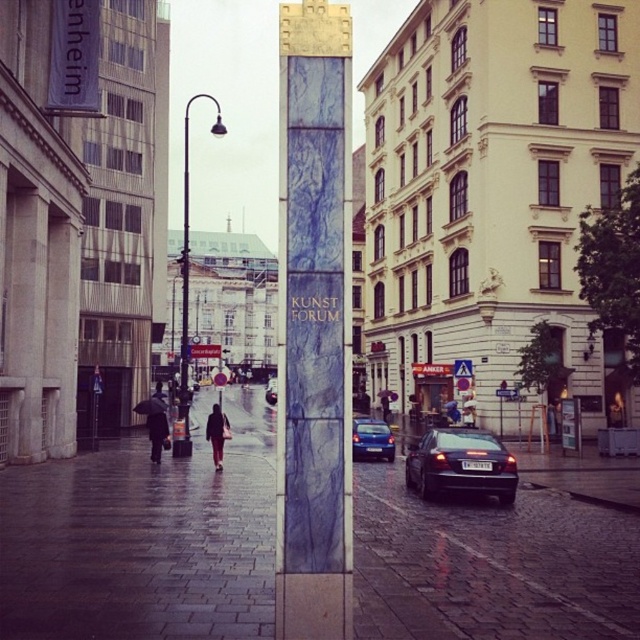
You are a delivery person trying to place a large package on the ground. You see the brick pavement at center and the dark brown leather coat at lower center. Which surface can you place the package on?

The brick pavement at center is bigger than the dark brown leather coat at lower center, so you can place the package on the brick pavement at center.

You are standing in front of the blue marble pillar at center. If you want to take a photo of it with your camera, which is 25.57 feet away, will you be able to capture the entire pillar in the frame without moving closer or farther?

The blue marble pillar at center and camera are 25.57 feet apart. Since the distance matches the required distance to capture the entire pillar, you can capture the entire pillar in the frame without moving.